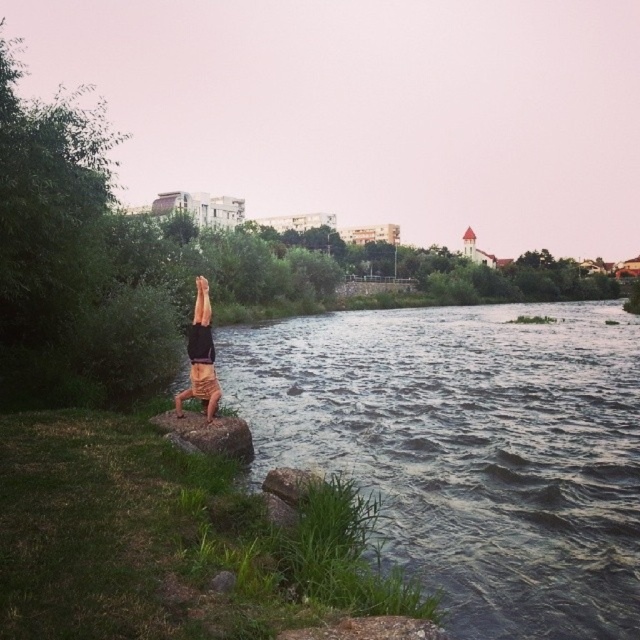
Question: Does dark gray water at center lie in front of tan shorts at center?

Choices:
 (A) yes
 (B) no

Answer: (A)

Question: Which point is closer to the camera taking this photo?

Choices:
 (A) (176, 401)
 (B) (444, 545)

Answer: (B)

Question: Which point is farther from the camera taking this photo?

Choices:
 (A) (465, 328)
 (B) (179, 394)

Answer: (A)

Question: Does dark gray water at center have a greater width compared to tan shorts at center?

Choices:
 (A) no
 (B) yes

Answer: (B)

Question: Observing the image, what is the correct spatial positioning of dark gray water at center in reference to tan shorts at center?

Choices:
 (A) below
 (B) above

Answer: (B)